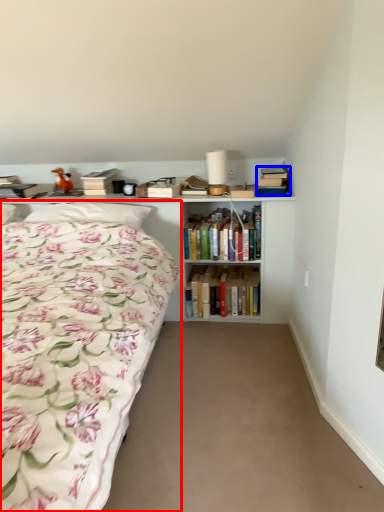
Question: Which point is further to the camera, bed (highlighted by a red box) or book (highlighted by a blue box)?

Choices:
 (A) bed
 (B) book

Answer: (B)